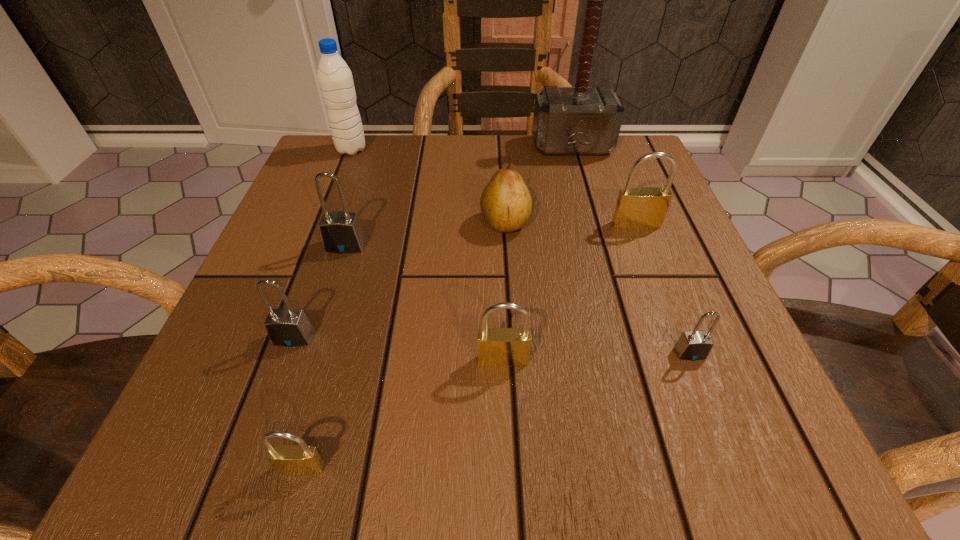
The width and height of the screenshot is (960, 540). In order to click on gray padlock that is the third closest to the second brass padlock from left to right in this screenshot , I will do `click(341, 232)`.

In order to click on brass padlock that can be found as the closest to the water bottle in this screenshot , I will do `click(637, 207)`.

Locate which brass padlock is the third closest to the biggest gray padlock. Please provide its 2D coordinates. Your answer should be formatted as a tuple, i.e. [(x, y)], where the tuple contains the x and y coordinates of a point satisfying the conditions above.

[(637, 207)]

I want to click on vacant space that satisfies the following two spatial constraints: 1. on the back side of the tallest object; 2. on the left side of the water bottle, so click(352, 147).